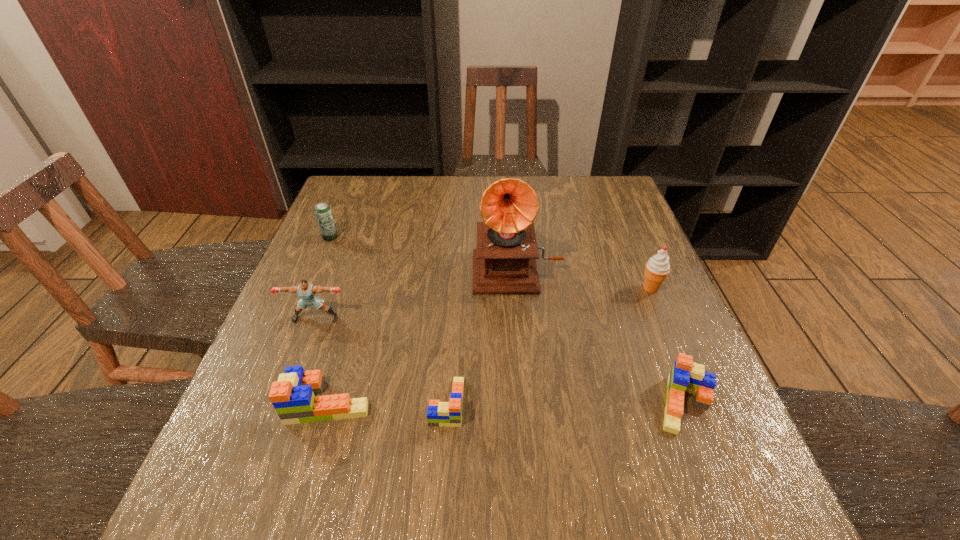
Identify the location of vacant spot for a new Lego to ensure equal spacing. This screenshot has height=540, width=960. (565, 403).